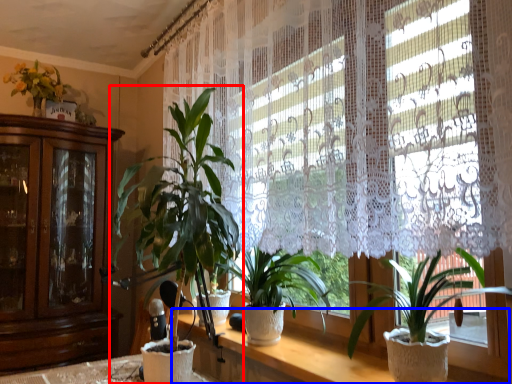
Question: Which of the following is the farthest to the observer, houseplant (highlighted by a red box) or vanity (highlighted by a blue box)?

Choices:
 (A) houseplant
 (B) vanity

Answer: (A)